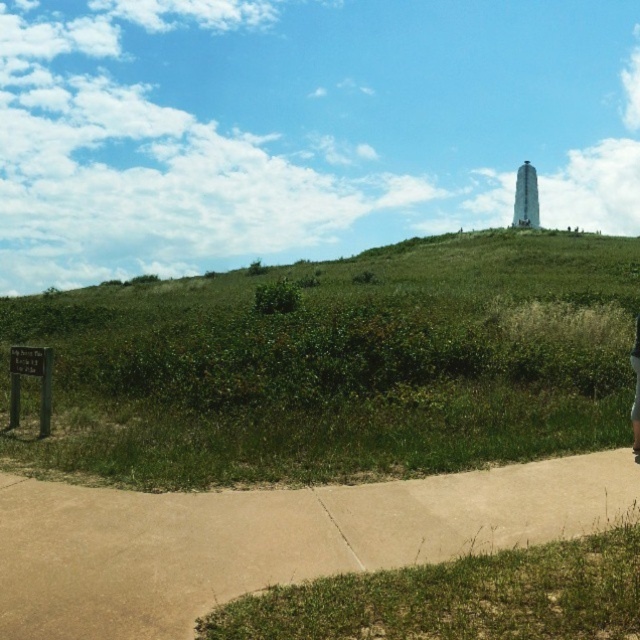
Question: Which point is closer to the camera?

Choices:
 (A) skinny jeans at lower right
 (B) beige concrete sidewalk at lower center
 (C) green grassy hill at upper center

Answer: (B)

Question: Is green grassy hill at upper center below skinny jeans at lower right?

Choices:
 (A) no
 (B) yes

Answer: (A)

Question: Which object is closer to the camera taking this photo?

Choices:
 (A) green grassy hill at upper center
 (B) beige concrete sidewalk at lower center

Answer: (B)

Question: Can you confirm if green grassy hill at upper center is wider than skinny jeans at lower right?

Choices:
 (A) yes
 (B) no

Answer: (A)

Question: Which point is farther to the camera?

Choices:
 (A) green grassy hill at upper center
 (B) skinny jeans at lower right
 (C) beige concrete sidewalk at lower center

Answer: (B)

Question: Can you confirm if green grassy hill at upper center is wider than beige concrete sidewalk at lower center?

Choices:
 (A) yes
 (B) no

Answer: (A)